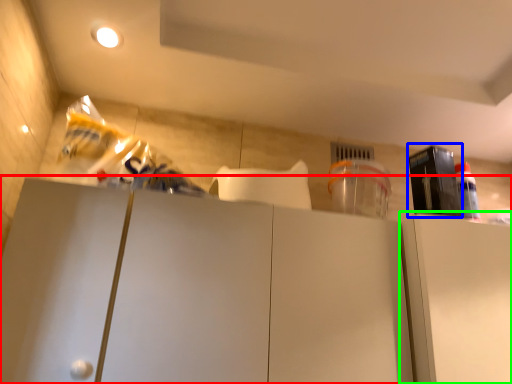
Question: Based on their relative distances, which object is nearer to cabinetry (highlighted by a red box)? Choose from appliance (highlighted by a blue box) and cabinetry (highlighted by a green box).

Choices:
 (A) appliance
 (B) cabinetry

Answer: (B)